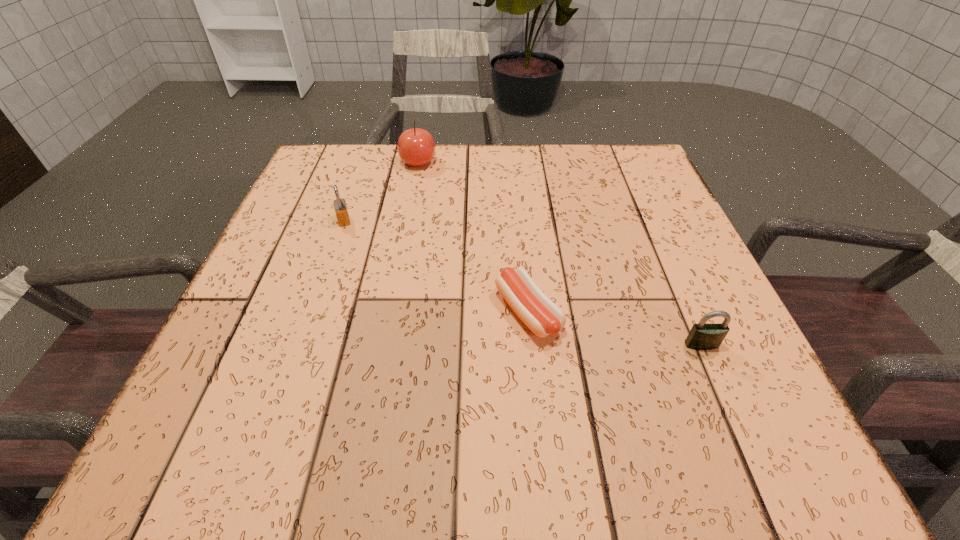
Locate an element on the screen. vacant region that satisfies the following two spatial constraints: 1. on the front side of the sausage; 2. on the right side of the rightmost object is located at coordinates (531, 345).

Identify the location of free spot that satisfies the following two spatial constraints: 1. on the front side of the second object from right to left; 2. on the right side of the third nearest object. The image size is (960, 540). (312, 312).